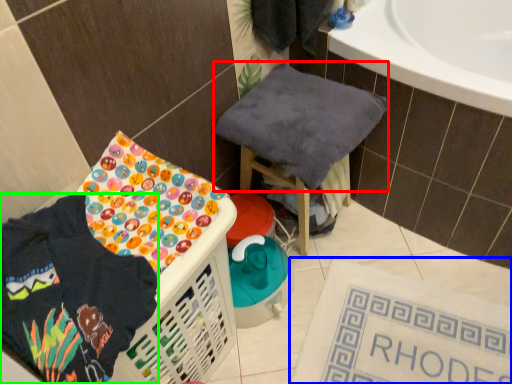
Question: Which object is positioned closest to baby clothe (highlighted by a red box)? Select from bath mat (highlighted by a blue box) and clothing (highlighted by a green box).

Choices:
 (A) bath mat
 (B) clothing

Answer: (A)